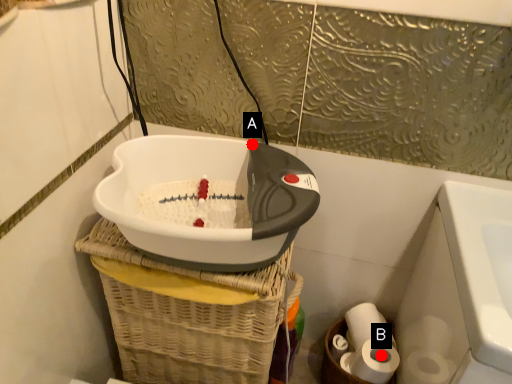
Question: Two points are circled on the image, labeled by A and B beside each circle. Which point appears closest to the camera in this image?

Choices:
 (A) A is closer
 (B) B is closer

Answer: (A)